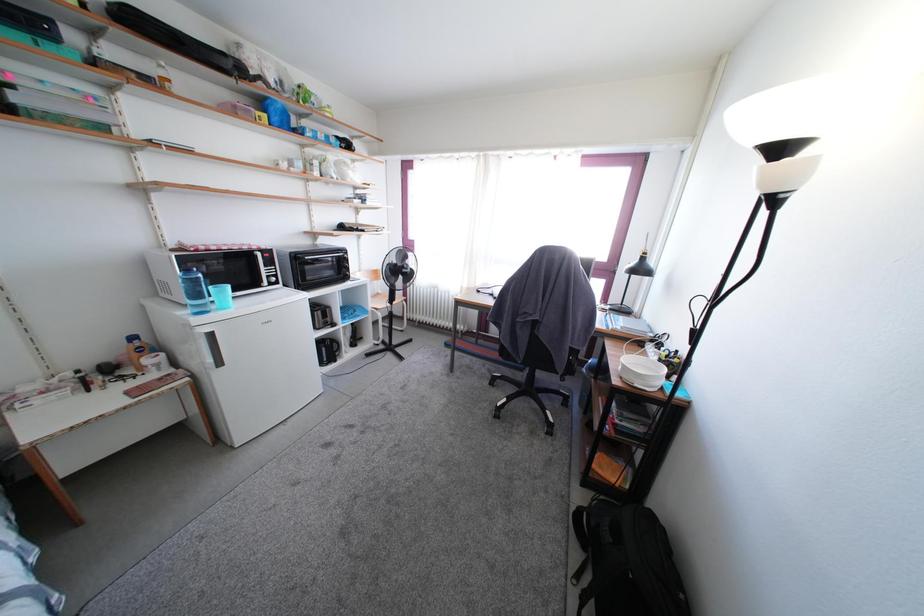
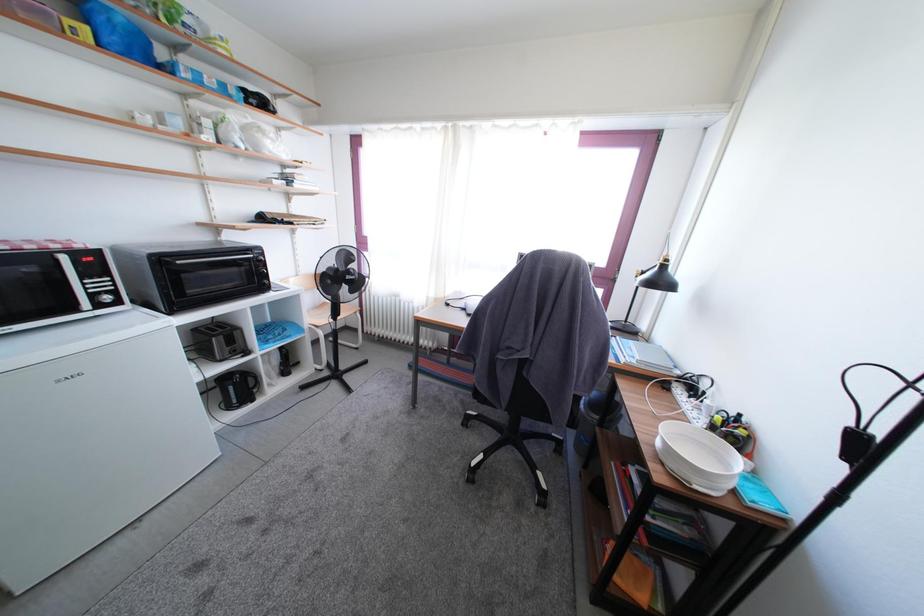
Question: The images are taken continuously from a first-person perspective. In which direction are you moving?

Choices:
 (A) Left
 (B) Right
 (C) Forward
 (D) Backward

Answer: (C)